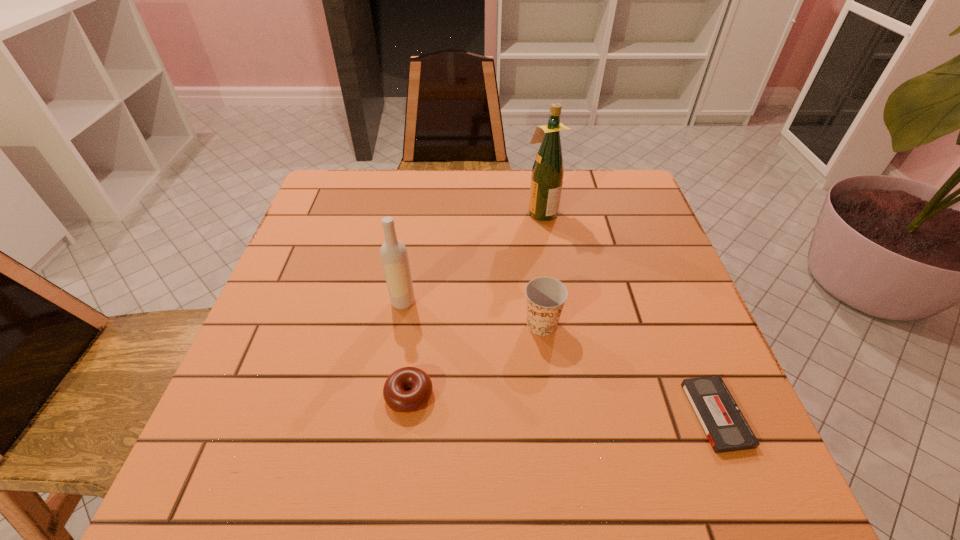
This screenshot has height=540, width=960. Identify the location of vacant space that is in between the third tallest object and the doughnut. (475, 360).

Find the location of `empty space that is in between the liquor and the second tallest object`. empty space that is in between the liquor and the second tallest object is located at coordinates (472, 256).

This screenshot has height=540, width=960. In order to click on free point between the tallest object and the second shortest object in this screenshot , I will do `click(475, 303)`.

Identify the location of vacant area between the shortest object and the third shortest object. The image size is (960, 540). (629, 369).

Select which object is the fourth closest to the third tallest object. Please provide its 2D coordinates. Your answer should be formatted as a tuple, i.e. [(x, y)], where the tuple contains the x and y coordinates of a point satisfying the conditions above.

[(547, 176)]

Identify the location of object that can be found as the second closest to the vodka. (545, 296).

Image resolution: width=960 pixels, height=540 pixels. Find the location of `free spot that satisfies the following two spatial constraints: 1. on the front side of the rightmost object; 2. on the left side of the third tallest object`. free spot that satisfies the following two spatial constraints: 1. on the front side of the rightmost object; 2. on the left side of the third tallest object is located at coordinates (553, 414).

At what (x,y) coordinates should I click in order to perform the action: click on vacant space that satisfies the following two spatial constraints: 1. on the front-facing side of the videotape; 2. on the left side of the liquor. Please return your answer as a coordinate pair (x, y). Looking at the image, I should click on (574, 414).

What are the coordinates of `free space in the image that satisfies the following two spatial constraints: 1. on the back side of the shortest object; 2. on the front-facing side of the tallest object` in the screenshot? It's located at (634, 212).

Where is `free space that satisfies the following two spatial constraints: 1. on the back side of the fourth tallest object; 2. on the left side of the Dixie cup`? The image size is (960, 540). free space that satisfies the following two spatial constraints: 1. on the back side of the fourth tallest object; 2. on the left side of the Dixie cup is located at coordinates (419, 324).